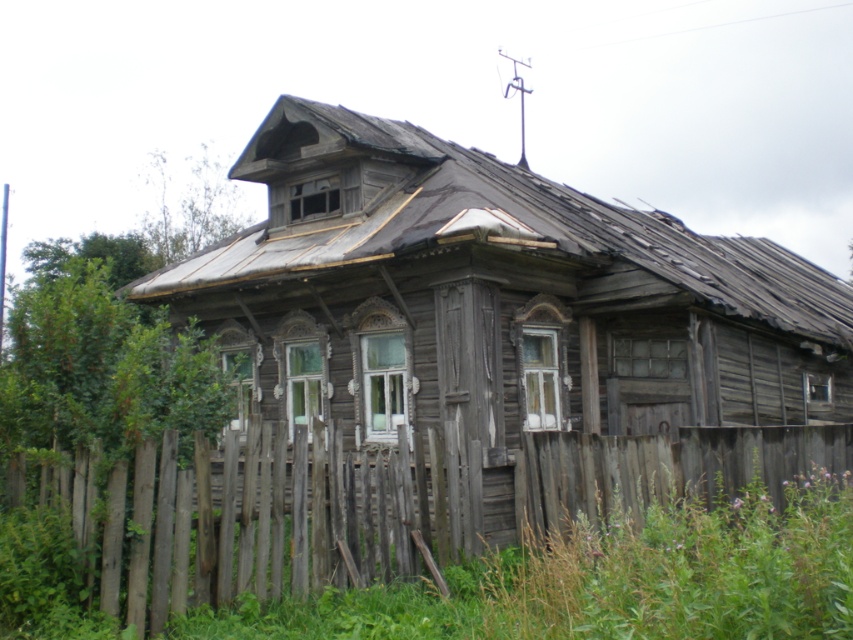
You are a painter standing at the lower center of the image, ready to paint the weathered wood hut at center and the weathered wood fence at lower center. Which object should you paint first if you want to start with the taller one?

The weathered wood hut at center is taller than the weathered wood fence at lower center, so you should start painting the weathered wood hut at center first.

You are standing in the rural area and want to approach the weathered wood hut at center and the weathered wood fence at lower center. Which structure will you encounter first as you move forward?

You will encounter the weathered wood fence at lower center first because it is closer to you than the weathered wood hut at center, which is further away.